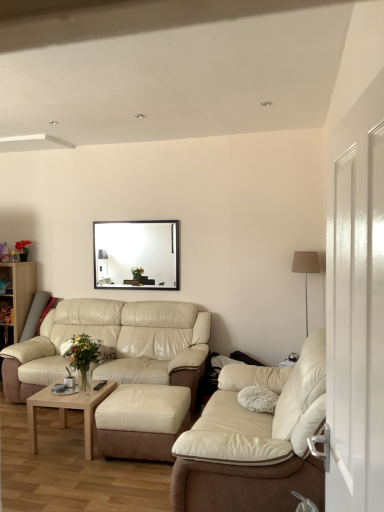
Locate an element on the screen. The height and width of the screenshot is (512, 384). vacant area that is in front of suede ottoman at center is located at coordinates (114, 483).